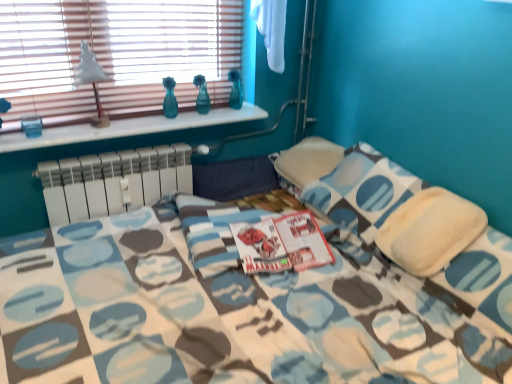
The height and width of the screenshot is (384, 512). Describe the element at coordinates (397, 210) in the screenshot. I see `soft white pillow at center` at that location.

Where is `wooden blinds at upper left`? This screenshot has width=512, height=384. wooden blinds at upper left is located at coordinates (114, 55).

Who is bigger, soft white pillow at center or white matte table lamp at upper left?

With larger size is soft white pillow at center.

Between soft white pillow at center and white matte table lamp at upper left, which one has more height?

Standing taller between the two is soft white pillow at center.

How different are the orientations of soft white pillow at center and white matte table lamp at upper left in degrees?

There is a 82.2-degree angle between the facing directions of soft white pillow at center and white matte table lamp at upper left.

Considering the positions of point (345, 223) and point (100, 126), is point (345, 223) closer or farther from the camera than point (100, 126)?

Point (345, 223) is closer to the camera than point (100, 126).

Based on the photo, is white marble window sill at upper left positioned in front of wooden blinds at upper left?

No, the depth of white marble window sill at upper left is greater than that of wooden blinds at upper left.

Is white marble window sill at upper left positioned far away from wooden blinds at upper left?

No, white marble window sill at upper left is not far from wooden blinds at upper left.

From the image's perspective, does white marble window sill at upper left appear higher than wooden blinds at upper left?

No, from the image's perspective, white marble window sill at upper left is not over wooden blinds at upper left.

Are soft white pillow at center and wooden blinds at upper left beside each other?

No, soft white pillow at center is not touching wooden blinds at upper left.

Can you confirm if soft white pillow at center is taller than wooden blinds at upper left?

Yes, soft white pillow at center is taller than wooden blinds at upper left.

What's the angular difference between wooden blinds at upper left and soft white pillow at center's facing directions?

The angular difference between wooden blinds at upper left and soft white pillow at center is 82.8 degrees.

Could soft white pillow at center be considered to be inside wooden blinds at upper left?

No, soft white pillow at center is not a part of wooden blinds at upper left.

From a real-world perspective, relative to soft white pillow at center, is wooden blinds at upper left vertically above or below?

In terms of real-world spatial position, wooden blinds at upper left is above soft white pillow at center.

Considering the relative positions of wooden blinds at upper left and soft white pillow at center in the image provided, is wooden blinds at upper left to the left of soft white pillow at center from the viewer's perspective?

Indeed, wooden blinds at upper left is positioned on the left side of soft white pillow at center.

Is white marble window sill at upper left directly adjacent to white matte table lamp at upper left?

No, white marble window sill at upper left is not with white matte table lamp at upper left.

Locate an element on the screen. This screenshot has height=384, width=512. window sill below the white matte table lamp at upper left (from a real-world perspective) is located at coordinates (129, 128).

Which is in front, point (5, 147) or point (85, 69)?

Positioned in front is point (5, 147).

Is white marble window sill at upper left completely or partially inside white plastic radiator at center?

No, white marble window sill at upper left is not a part of white plastic radiator at center.

Which is further, (77, 204) or (79, 126)?

The point (77, 204) is more distant.

Relative to white marble window sill at upper left, is white plastic radiator at center in front or behind?

white plastic radiator at center is positioned farther from the viewer than white marble window sill at upper left.

In the image, is wooden blinds at upper left positioned in front of or behind white plastic radiator at center?

In the image, wooden blinds at upper left appears in front of white plastic radiator at center.

Which is further, (210, 17) or (86, 218)?

Point (210, 17)

From the picture: Which of these two, wooden blinds at upper left or white plastic radiator at center, stands taller?

With more height is wooden blinds at upper left.

Would you say wooden blinds at upper left is to the left or to the right of white plastic radiator at center in the picture?

From the image, it's evident that wooden blinds at upper left is to the right of white plastic radiator at center.

In order to click on pillow in front of the white matte table lamp at upper left in this screenshot , I will do `click(397, 210)`.

Find the location of `window that is above the white marble window sill at upper left (from a real-world perspective)`. window that is above the white marble window sill at upper left (from a real-world perspective) is located at coordinates (114, 55).

From the image, which object appears to be farther from white marble window sill at upper left, wooden blinds at upper left or white matte table lamp at upper left?

Based on the image, wooden blinds at upper left appears to be further to white marble window sill at upper left.

Estimate the real-world distances between objects in this image. Which object is further from white marble window sill at upper left, soft white pillow at center or wooden blinds at upper left?

The object further to white marble window sill at upper left is soft white pillow at center.

Based on their spatial positions, is white matte table lamp at upper left or wooden blinds at upper left further from soft white pillow at center?

The object further to soft white pillow at center is white matte table lamp at upper left.

Looking at the image, which one is located closer to wooden blinds at upper left, soft white pillow at center or white matte table lamp at upper left?

white matte table lamp at upper left is positioned closer to the anchor wooden blinds at upper left.

Which object lies further to the anchor point white marble window sill at upper left, white plastic radiator at center or white matte table lamp at upper left?

white matte table lamp at upper left is positioned further to the anchor white marble window sill at upper left.

Based on their spatial positions, is white marble window sill at upper left or wooden blinds at upper left further from white plastic radiator at center?

The object further to white plastic radiator at center is wooden blinds at upper left.

Consider the image. From the image, which object appears to be farther from soft white pillow at center, white plastic radiator at center or white matte table lamp at upper left?

white matte table lamp at upper left is further to soft white pillow at center.

Which object lies nearer to the anchor point white marble window sill at upper left, soft white pillow at center or white matte table lamp at upper left?

white matte table lamp at upper left is positioned closer to the anchor white marble window sill at upper left.

In order to click on window between white matte table lamp at upper left and soft white pillow at center in the horizontal direction in this screenshot , I will do click(x=114, y=55).

Locate an element on the screen. window sill between white plastic radiator at center and soft white pillow at center in the horizontal direction is located at coordinates (129, 128).

I want to click on table lamp between wooden blinds at upper left and white plastic radiator at center in the up-down direction, so click(x=91, y=81).

Find the location of a particular element. The height and width of the screenshot is (384, 512). table lamp between wooden blinds at upper left and white marble window sill at upper left in the vertical direction is located at coordinates (91, 81).